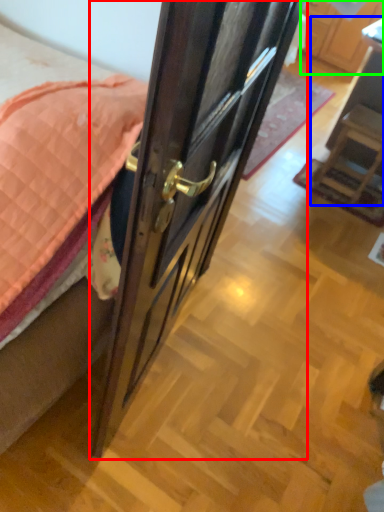
Question: Which object is the closest to the door (highlighted by a red box)? Choose among these: furniture (highlighted by a blue box) or cabinetry (highlighted by a green box).

Choices:
 (A) furniture
 (B) cabinetry

Answer: (A)